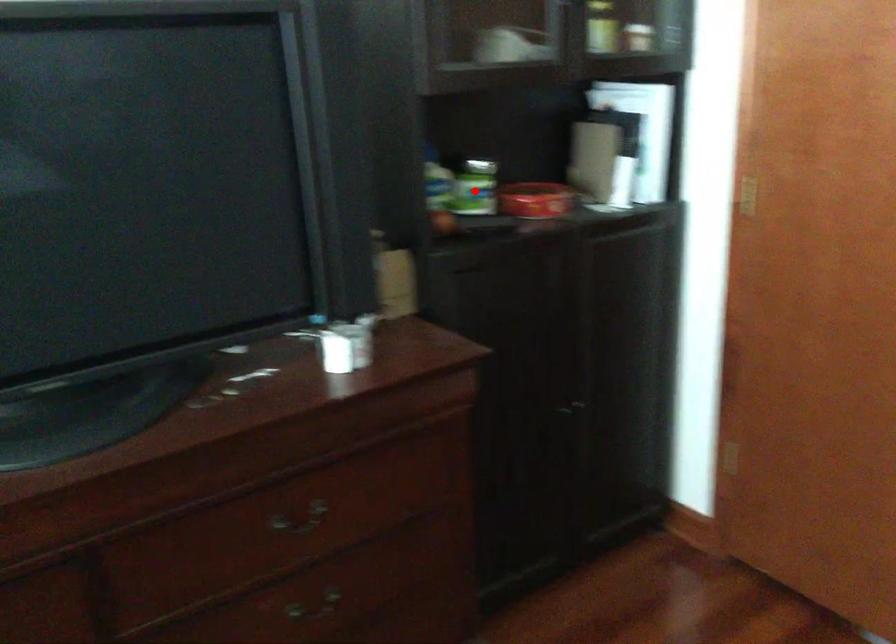
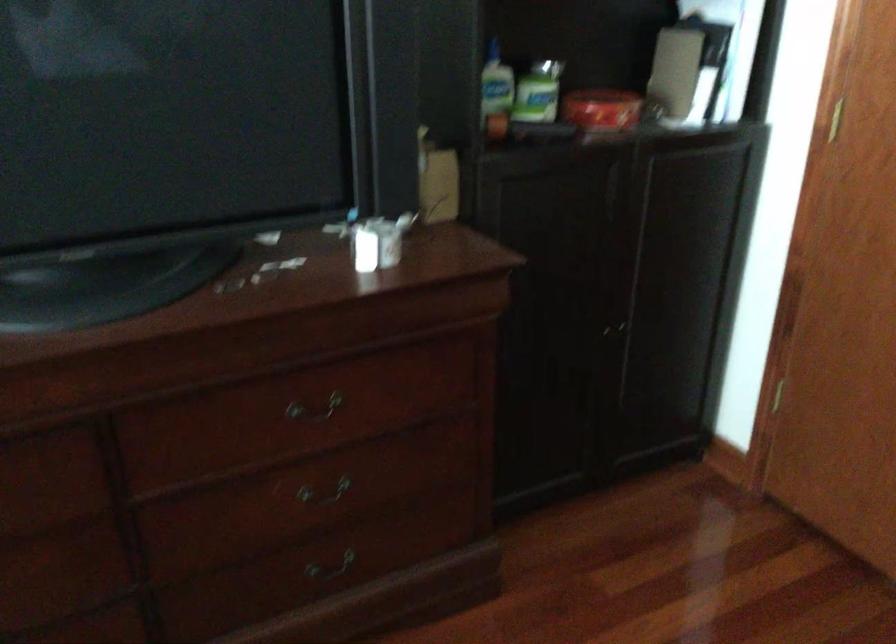
Locate, in the second image, the point that corresponds to the highlighted location in the first image.

(538, 91)